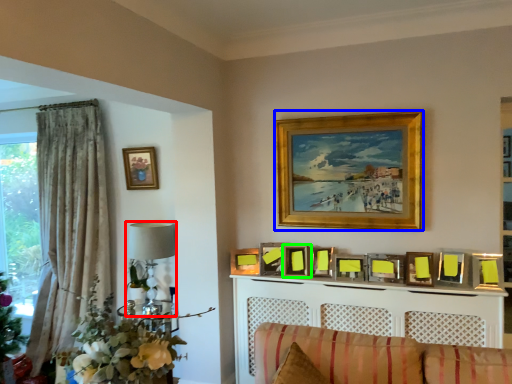
Question: Which is nearer to the lamp (highlighted by a red box)? picture frame (highlighted by a blue box) or picture frame (highlighted by a green box).

Choices:
 (A) picture frame
 (B) picture frame

Answer: (B)